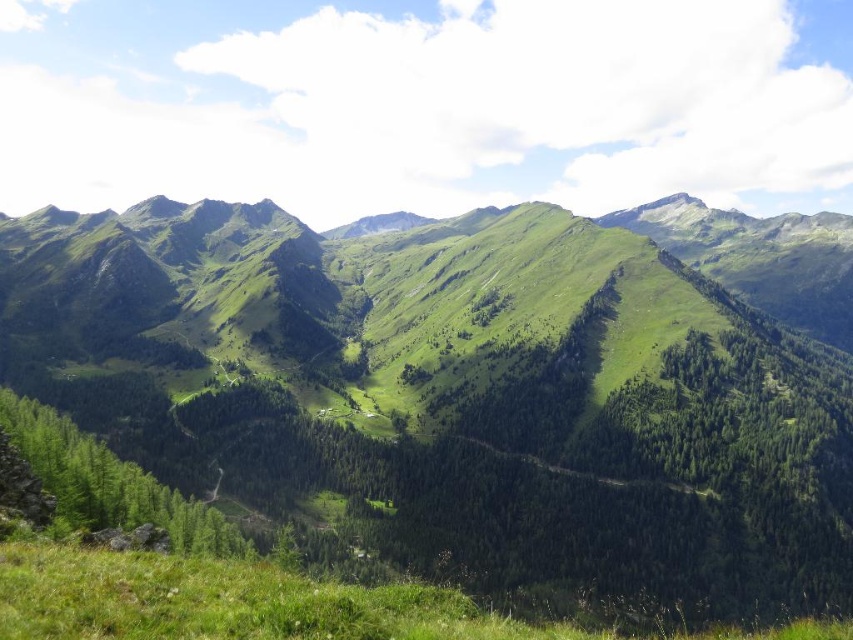
Question: Which point appears farthest from the camera in this image?

Choices:
 (A) (111, 628)
 (B) (773, 492)

Answer: (B)

Question: Is green grassy mountain at center further to camera compared to green grassy at lower center?

Choices:
 (A) yes
 (B) no

Answer: (A)

Question: Is green grassy mountain at center wider than green grassy at lower center?

Choices:
 (A) no
 (B) yes

Answer: (B)

Question: Is green grassy mountain at center further to camera compared to green grassy at lower center?

Choices:
 (A) yes
 (B) no

Answer: (A)